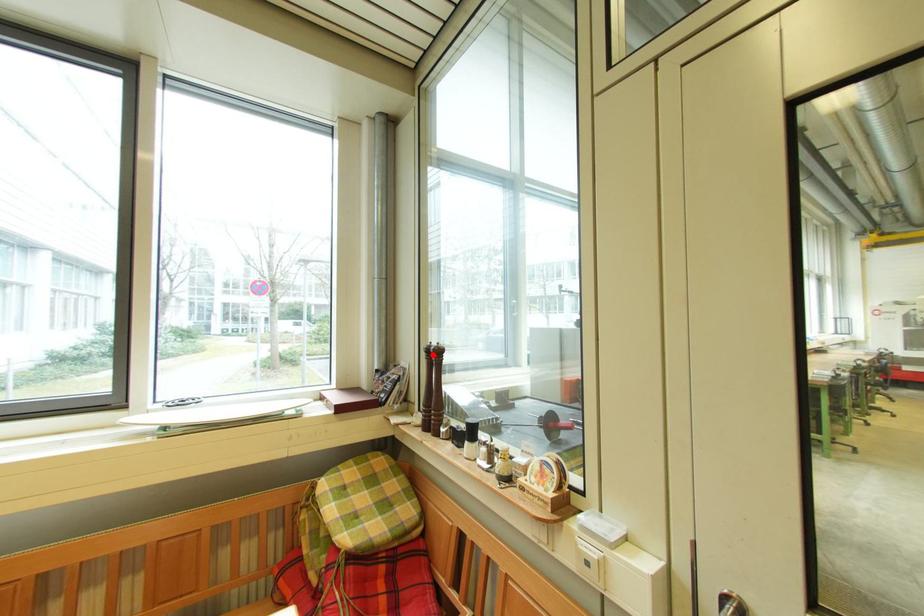
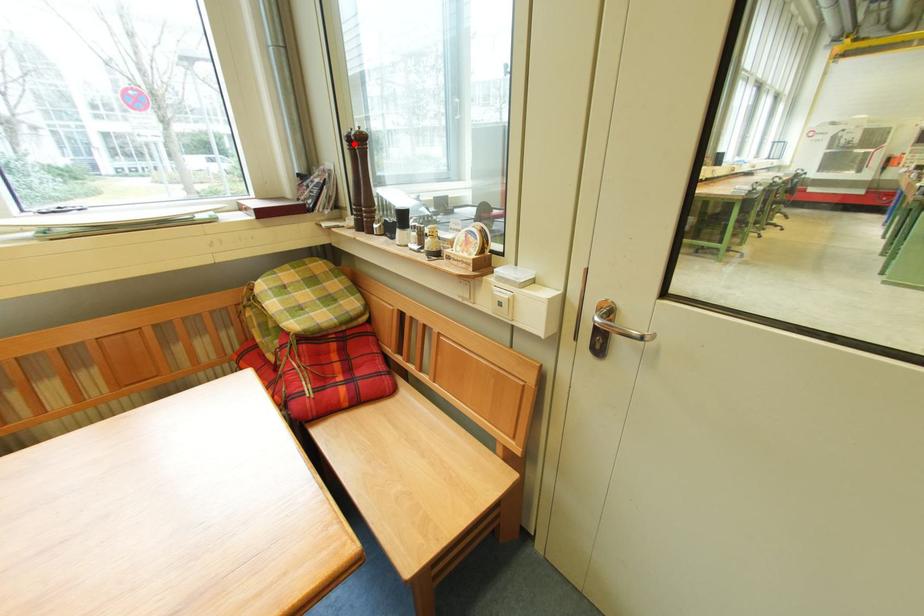
I am providing you with two images of the same scene from different viewpoints. A red point is marked on the first image and another point is marked on the second image. Is the red point in image1 aligned with the point shown in image2?

Yes